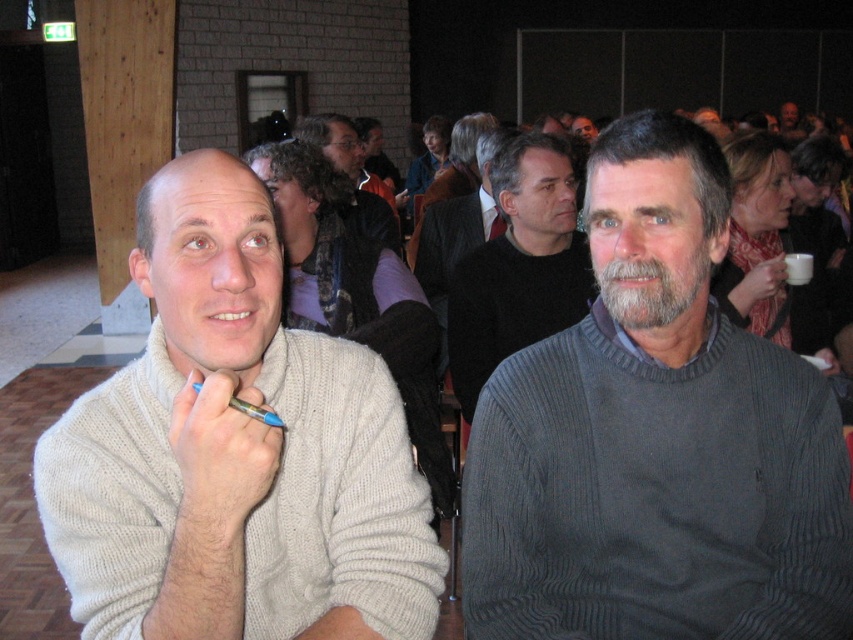
Question: Is dark gray ribbed sweater at center further to camera compared to dark brown sweater at center?

Choices:
 (A) no
 (B) yes

Answer: (A)

Question: Among these objects, which one is nearest to the camera?

Choices:
 (A) dark brown sweater at center
 (B) dark gray ribbed sweater at center

Answer: (B)

Question: Which object is farther from the camera taking this photo?

Choices:
 (A) dark brown sweater at center
 (B) beige knitted sweater at left

Answer: (A)

Question: Where is dark gray sweater at center located in relation to dark brown sweater at center in the image?

Choices:
 (A) right
 (B) left

Answer: (A)

Question: Which object appears farthest from the camera in this image?

Choices:
 (A) beige knitted sweater at left
 (B) dark brown sweater at center

Answer: (B)

Question: In this image, where is dark gray ribbed sweater at center located relative to beige knitted sweater at left?

Choices:
 (A) right
 (B) left

Answer: (A)